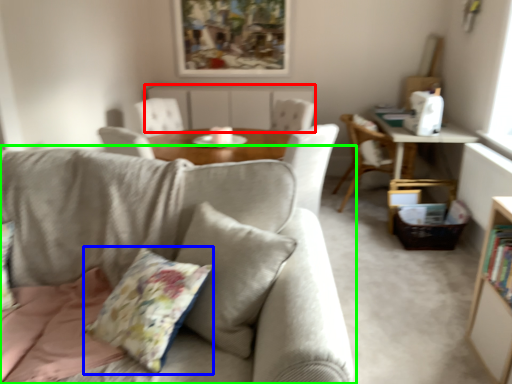
Question: Based on their relative distances, which object is farther from beige (highlighted by a red box)? Choose from throw pillow (highlighted by a blue box) and studio couch (highlighted by a green box).

Choices:
 (A) throw pillow
 (B) studio couch

Answer: (A)